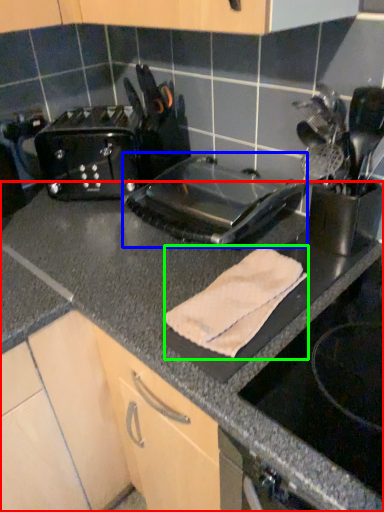
Question: Based on their relative distances, which object is nearer to countertop (highlighted by a red box)? Choose from kitchen appliance (highlighted by a blue box) and bath towel (highlighted by a green box).

Choices:
 (A) kitchen appliance
 (B) bath towel

Answer: (B)